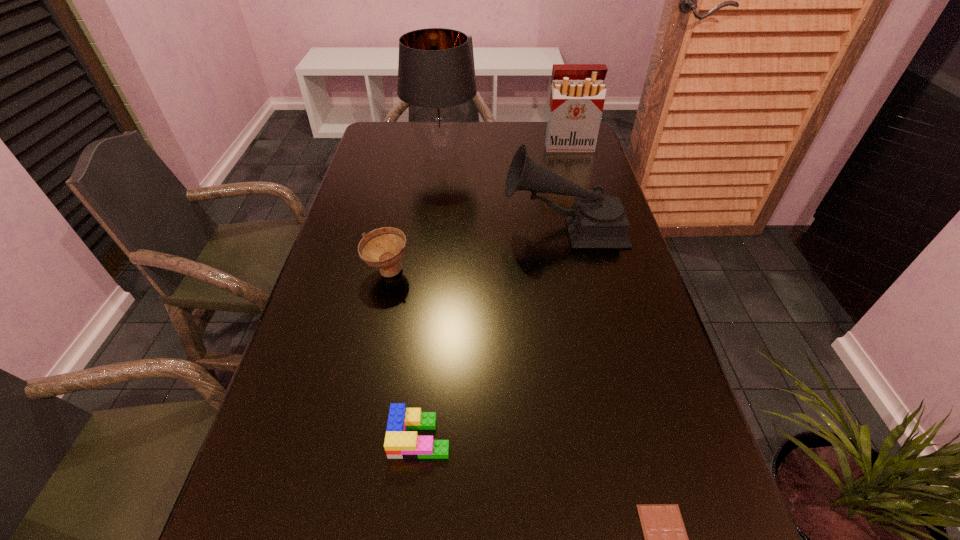
Identify the location of vacant region located from the horn of the phonograph_record. The width and height of the screenshot is (960, 540). (413, 227).

I want to click on vacant space located from the horn of the phonograph_record, so click(x=438, y=227).

Locate an element on the screen. This screenshot has height=540, width=960. vacant space located 0.100m on the right of the third shortest object is located at coordinates (451, 272).

Locate an element on the screen. blank space located on the left of the second nearest object is located at coordinates (279, 437).

The width and height of the screenshot is (960, 540). I want to click on lampshade that is at the far edge, so click(x=435, y=73).

Image resolution: width=960 pixels, height=540 pixels. I want to click on cigarette case that is positioned at the far edge, so click(577, 97).

I want to click on lampshade that is positioned at the left edge, so click(435, 73).

The width and height of the screenshot is (960, 540). What are the coordinates of `soup bowl that is at the left edge` in the screenshot? It's located at (383, 248).

Locate an element on the screen. The height and width of the screenshot is (540, 960). cigarette case present at the right edge is located at coordinates (577, 97).

At what (x,y) coordinates should I click in order to perform the action: click on phonograph_record that is at the right edge. Please return your answer as a coordinate pair (x, y). Looking at the image, I should click on (596, 221).